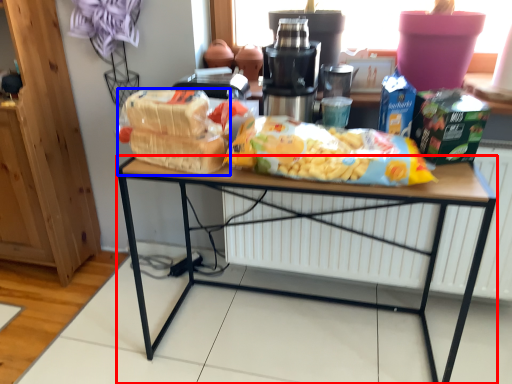
Question: Among these objects, which one is nearest to the camera, desk (highlighted by a red box) or snack (highlighted by a blue box)?

Choices:
 (A) desk
 (B) snack

Answer: (A)